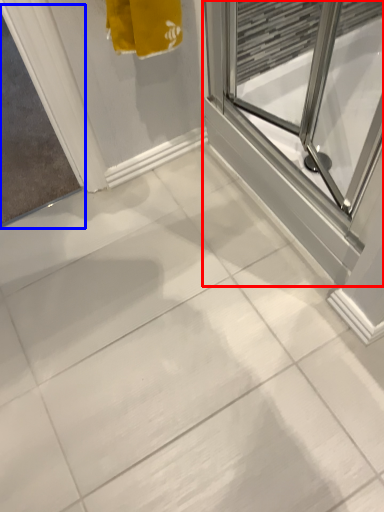
Question: Which object is closer to the camera taking this photo, screen door (highlighted by a red box) or window screen (highlighted by a blue box)?

Choices:
 (A) screen door
 (B) window screen

Answer: (A)